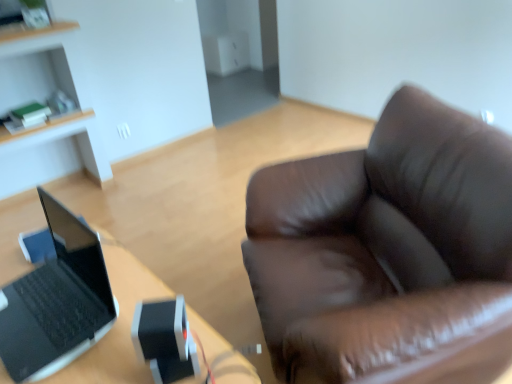
This screenshot has height=384, width=512. I want to click on black plastic laptop at left, so click(x=103, y=318).

At what (x,y) coordinates should I click in order to perform the action: click on black matte laptop at left. Please return your answer as a coordinate pair (x, y). The height and width of the screenshot is (384, 512). Looking at the image, I should click on (57, 301).

How much distance is there between light wood cabinet at upper left and black matte laptop at left?

6.15 feet.

Which object is wider, light wood cabinet at upper left or black matte laptop at left?

light wood cabinet at upper left is wider.

Locate an element on the screen. The image size is (512, 384). laptop positioned vertically above the light wood cabinet at upper left (from a real-world perspective) is located at coordinates (57, 301).

Is light wood cabinet at upper left further to camera compared to black matte laptop at left?

Yes, light wood cabinet at upper left is behind black matte laptop at left.

From a real-world perspective, is black matte laptop at left over light wood cabinet at upper left?

Yes, from a real-world perspective, black matte laptop at left is above light wood cabinet at upper left.

Based on the photo, are black matte laptop at left and light wood cabinet at upper left making contact?

No, black matte laptop at left is not with light wood cabinet at upper left.

From the image's perspective, between black matte laptop at left and light wood cabinet at upper left, who is located below?

black matte laptop at left, from the image's perspective.

Which of these two, black matte laptop at left or light wood cabinet at upper left, stands shorter?

black matte laptop at left is shorter.

How different are the orientations of black matte laptop at left and black plastic laptop at left in degrees?

The facing directions of black matte laptop at left and black plastic laptop at left are 0.692 degrees apart.

Who is smaller, black matte laptop at left or black plastic laptop at left?

black matte laptop at left is smaller.

Consider the image. Between black matte laptop at left and black plastic laptop at left, which one has larger width?

black plastic laptop at left is wider.

From the image's perspective, is black matte laptop at left under black plastic laptop at left?

Incorrect, from the image's perspective, black matte laptop at left is higher than black plastic laptop at left.

Are black plastic laptop at left and black matte laptop at left far apart?

No.

Is black plastic laptop at left taller or shorter than black matte laptop at left?

black plastic laptop at left is taller than black matte laptop at left.

Does black plastic laptop at left appear on the left side of black matte laptop at left?

Incorrect, black plastic laptop at left is not on the left side of black matte laptop at left.

Is black plastic laptop at left inside or outside of black matte laptop at left?

black plastic laptop at left is outside black matte laptop at left.

Is black plastic laptop at left facing towards light wood cabinet at upper left?

No, black plastic laptop at left does not turn towards light wood cabinet at upper left.

Is black plastic laptop at left to the right of light wood cabinet at upper left from the viewer's perspective?

Yes, black plastic laptop at left is to the right of light wood cabinet at upper left.

The width and height of the screenshot is (512, 384). In order to click on cabinetry located above the black plastic laptop at left (from the image's perspective) in this screenshot , I will do `click(40, 101)`.

Can you see black plastic laptop at left touching light wood cabinet at upper left?

No, black plastic laptop at left is not making contact with light wood cabinet at upper left.

Is black plastic laptop at left at the back of light wood cabinet at upper left?

No.

Is light wood cabinet at upper left to the left of black plastic laptop at left from the viewer's perspective?

Yes.

From a real-world perspective, is light wood cabinet at upper left above or below black plastic laptop at left?

Clearly, from a real-world perspective, light wood cabinet at upper left is above black plastic laptop at left.

Which point is more distant from viewer, (89, 123) or (88, 366)?

Positioned behind is point (89, 123).

Where is `laptop that is in front of the light wood cabinet at upper left`? The width and height of the screenshot is (512, 384). laptop that is in front of the light wood cabinet at upper left is located at coordinates (57, 301).

The height and width of the screenshot is (384, 512). I want to click on cabinetry lying behind the black matte laptop at left, so click(x=40, y=101).

In the scene shown: Looking at the image, which one is located further to light wood cabinet at upper left, black matte laptop at left or black plastic laptop at left?

black matte laptop at left is positioned further to the anchor light wood cabinet at upper left.

From the image, which object appears to be nearer to light wood cabinet at upper left, black plastic laptop at left or black matte laptop at left?

black plastic laptop at left.

Looking at the image, which one is located closer to black matte laptop at left, black plastic laptop at left or light wood cabinet at upper left?

black plastic laptop at left lies closer to black matte laptop at left than the other object.

Which object lies further to the anchor point black matte laptop at left, light wood cabinet at upper left or black plastic laptop at left?

light wood cabinet at upper left.

When comparing their distances from black plastic laptop at left, does black matte laptop at left or light wood cabinet at upper left seem further?

light wood cabinet at upper left is positioned further to the anchor black plastic laptop at left.

When comparing their distances from black plastic laptop at left, does light wood cabinet at upper left or black matte laptop at left seem further?

light wood cabinet at upper left is further to black plastic laptop at left.

At what (x,y) coordinates should I click in order to perform the action: click on laptop between black plastic laptop at left and light wood cabinet at upper left along the z-axis. Please return your answer as a coordinate pair (x, y). Looking at the image, I should click on tap(57, 301).